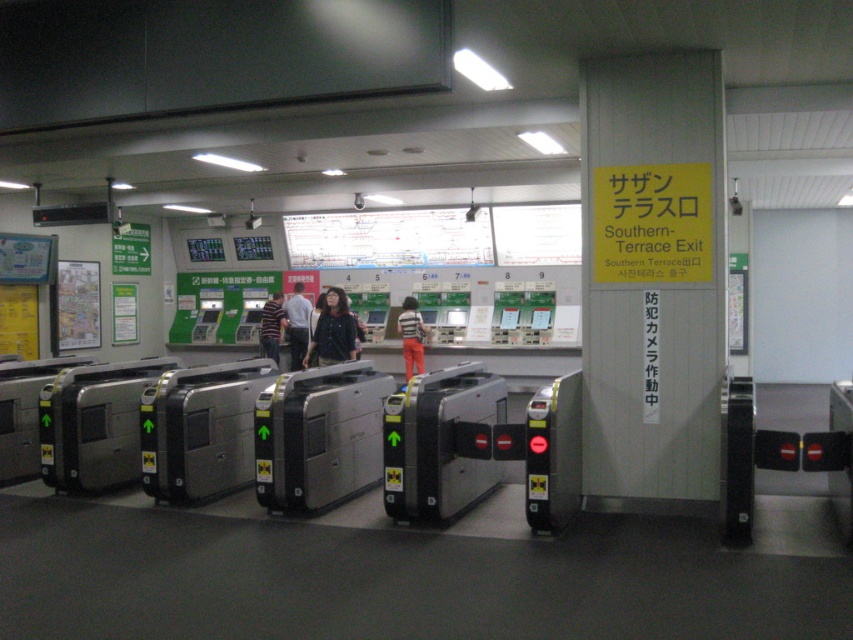
You are a passenger at the train station and see both the striped shirt at center and the striped cotton shirt at center. Which one is nearer to you?

The striped shirt at center is closer to the viewer than the striped cotton shirt at center.

You are a passenger at the train station and you see a dark blue jacket at center and a striped shirt at center. Which clothing item is positioned to the left?

The dark blue jacket at center is to the left of the striped shirt at center.

You are a security guard at the train station and need to determine which passenger to approach first. Both the dark blue shirt at center and the striped shirt at center are standing in the restricted area near the closed turnstiles. Which passenger should you approach based on their clothing size?

The dark blue shirt at center has a larger width than the striped shirt at center, so you should approach the dark blue shirt at center first since they are more noticeable due to their larger clothing size.